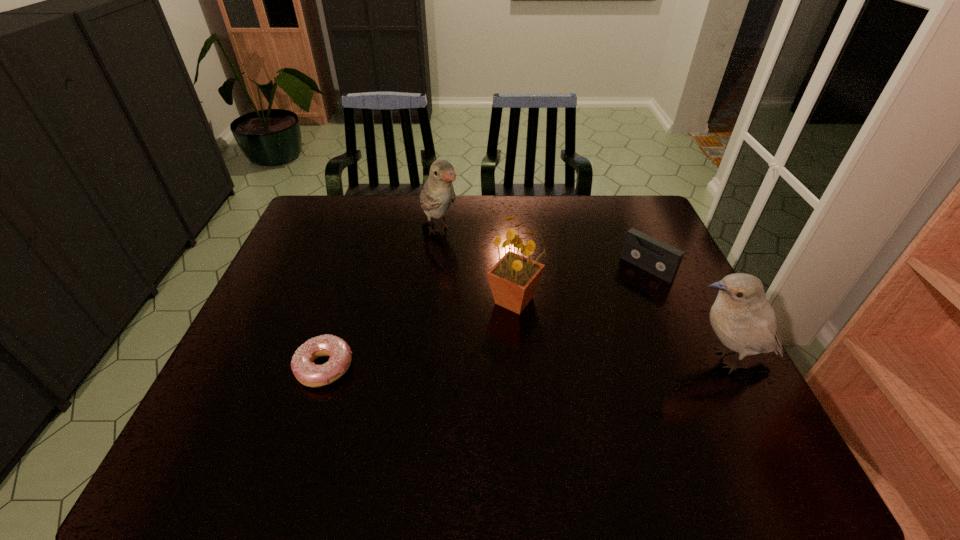
The width and height of the screenshot is (960, 540). In order to click on the shortest object in this screenshot , I will do coord(309,374).

In order to click on the leftmost object in this screenshot , I will do `click(309, 374)`.

Where is `the right bird`? This screenshot has height=540, width=960. the right bird is located at coordinates (742, 318).

Image resolution: width=960 pixels, height=540 pixels. What are the coordinates of `videotape` in the screenshot? It's located at (640, 249).

Find the location of `the third object from right to left`. the third object from right to left is located at coordinates (514, 278).

This screenshot has height=540, width=960. What are the coordinates of `the farthest object` in the screenshot? It's located at (438, 193).

The image size is (960, 540). I want to click on the left bird, so click(438, 193).

Locate an element on the screen. free space located on the right of the shortest object is located at coordinates (416, 367).

Where is `free spot located at the beak of the nearer bird`? Image resolution: width=960 pixels, height=540 pixels. free spot located at the beak of the nearer bird is located at coordinates (575, 360).

The height and width of the screenshot is (540, 960). Identify the location of vacant space located 0.170m at the beak of the nearer bird. (604, 360).